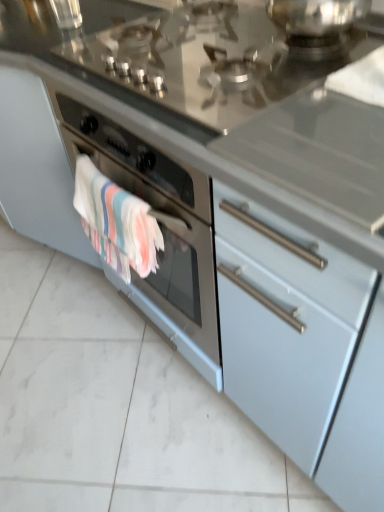
Question: Is multicolored woven towel at lower left smaller than glossy stainless steel stovetop at upper center?

Choices:
 (A) no
 (B) yes

Answer: (B)

Question: Is multicolored woven towel at lower left bigger than glossy stainless steel stovetop at upper center?

Choices:
 (A) no
 (B) yes

Answer: (A)

Question: From the image's perspective, is multicolored woven towel at lower left under glossy stainless steel stovetop at upper center?

Choices:
 (A) no
 (B) yes

Answer: (B)

Question: Is multicolored woven towel at lower left further to camera compared to glossy stainless steel stovetop at upper center?

Choices:
 (A) yes
 (B) no

Answer: (A)

Question: Considering the relative sizes of multicolored woven towel at lower left and glossy stainless steel stovetop at upper center in the image provided, is multicolored woven towel at lower left thinner than glossy stainless steel stovetop at upper center?

Choices:
 (A) yes
 (B) no

Answer: (A)

Question: Are multicolored woven towel at lower left and glossy stainless steel stovetop at upper center making contact?

Choices:
 (A) no
 (B) yes

Answer: (A)

Question: From the image's perspective, is glossy stainless steel stovetop at upper center under multicolored woven towel at lower left?

Choices:
 (A) no
 (B) yes

Answer: (A)

Question: Is glossy stainless steel stovetop at upper center bigger than multicolored woven towel at lower left?

Choices:
 (A) yes
 (B) no

Answer: (A)

Question: Is glossy stainless steel stovetop at upper center directly adjacent to multicolored woven towel at lower left?

Choices:
 (A) no
 (B) yes

Answer: (A)

Question: Could you tell me if glossy stainless steel stovetop at upper center is facing multicolored woven towel at lower left?

Choices:
 (A) yes
 (B) no

Answer: (B)

Question: From a real-world perspective, does glossy stainless steel stovetop at upper center sit lower than multicolored woven towel at lower left?

Choices:
 (A) no
 (B) yes

Answer: (A)

Question: Is glossy stainless steel stovetop at upper center looking in the opposite direction of multicolored woven towel at lower left?

Choices:
 (A) yes
 (B) no

Answer: (B)

Question: Considering the positions of multicolored woven towel at lower left and glossy stainless steel stovetop at upper center in the image, is multicolored woven towel at lower left wider or thinner than glossy stainless steel stovetop at upper center?

Choices:
 (A) thin
 (B) wide

Answer: (A)